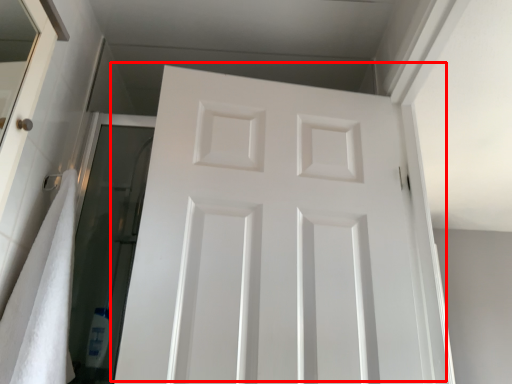
Question: From the image, what is the correct spatial relationship of door (annotated by the red box) in relation to bath towel?

Choices:
 (A) left
 (B) right

Answer: (B)